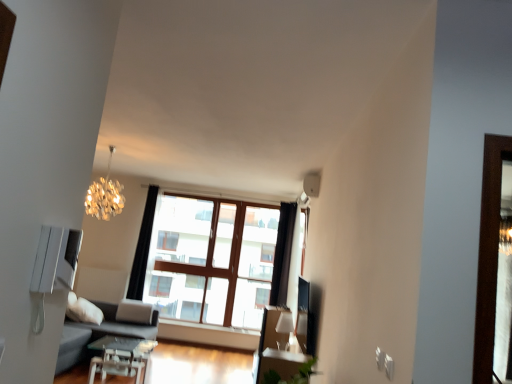
Question: Is shiny metallic chandelier at upper left, the 1th lamp from the left, completely or partially inside clear glass window at center?

Choices:
 (A) yes
 (B) no

Answer: (B)

Question: From the image's perspective, is clear glass window at center on top of shiny metallic chandelier at upper left, the 1th lamp from the left?

Choices:
 (A) no
 (B) yes

Answer: (A)

Question: Is clear glass window at center positioned beyond the bounds of shiny metallic chandelier at upper left, acting as the second lamp starting from the right?

Choices:
 (A) yes
 (B) no

Answer: (A)

Question: Is clear glass window at center aimed at shiny metallic chandelier at upper left, acting as the second lamp starting from the right?

Choices:
 (A) no
 (B) yes

Answer: (B)

Question: Is clear glass window at center positioned behind shiny metallic chandelier at upper left, which ranks as the first lamp in top-to-bottom order?

Choices:
 (A) no
 (B) yes

Answer: (B)

Question: From a real-world perspective, is clear glass window at center over shiny metallic chandelier at upper left, the 1th lamp from the left?

Choices:
 (A) no
 (B) yes

Answer: (A)

Question: Would you say white glossy lampshade at upper center, the 1th lamp when ordered from bottom to top, is part of clear glass window at center's contents?

Choices:
 (A) no
 (B) yes

Answer: (A)

Question: Does clear glass window at center lie behind white glossy lampshade at upper center, acting as the first lamp starting from the right?

Choices:
 (A) yes
 (B) no

Answer: (A)

Question: Is clear glass window at center shorter than white glossy lampshade at upper center, acting as the first lamp starting from the right?

Choices:
 (A) no
 (B) yes

Answer: (A)

Question: Considering the relative positions of clear glass window at center and white glossy lampshade at upper center, the 1th lamp when ordered from bottom to top, in the image provided, is clear glass window at center to the left of white glossy lampshade at upper center, the 1th lamp when ordered from bottom to top, from the viewer's perspective?

Choices:
 (A) yes
 (B) no

Answer: (A)

Question: Does clear glass window at center have a larger size compared to white glossy lampshade at upper center, the 1th lamp when ordered from bottom to top?

Choices:
 (A) no
 (B) yes

Answer: (B)

Question: From the image's perspective, is clear glass window at center over white glossy lampshade at upper center, acting as the first lamp starting from the right?

Choices:
 (A) no
 (B) yes

Answer: (B)

Question: Does white glossy lampshade at upper center, the 1th lamp when ordered from bottom to top, lie behind shiny metallic chandelier at upper left, which is the second lamp in bottom-to-top order?

Choices:
 (A) no
 (B) yes

Answer: (B)